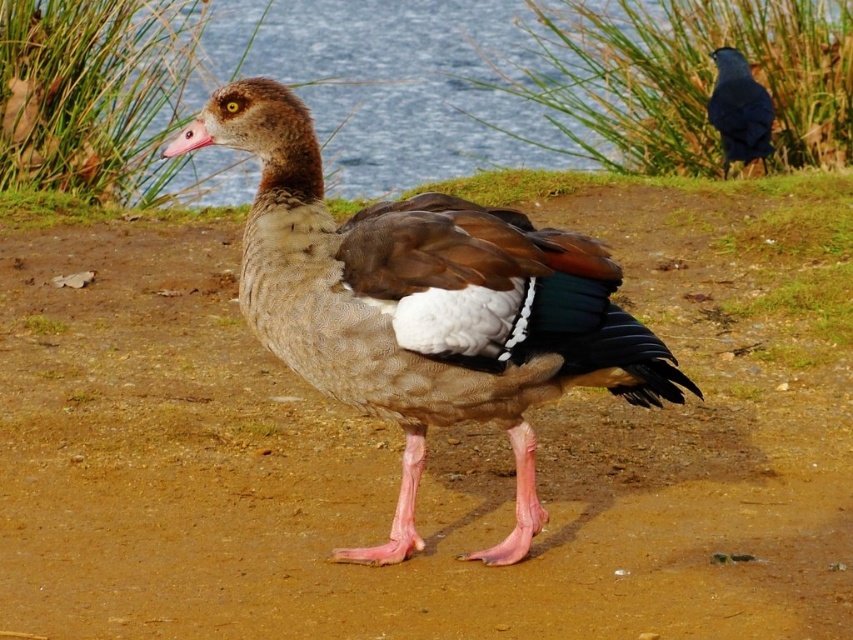
Question: Does brown dirt field at center have a greater width compared to shiny blue bird at upper right?

Choices:
 (A) no
 (B) yes

Answer: (B)

Question: Among these points, which one is farthest from the camera?

Choices:
 (A) (732, 145)
 (B) (520, 433)

Answer: (A)

Question: Does blue water at upper center have a smaller size compared to pink matte beak at center?

Choices:
 (A) yes
 (B) no

Answer: (B)

Question: Can you confirm if brown dirt field at center is bigger than brown feathered duck at center?

Choices:
 (A) yes
 (B) no

Answer: (A)

Question: Which object is farther from the camera taking this photo?

Choices:
 (A) blue water at upper center
 (B) brown feathered duck at center
 (C) brown dirt field at center

Answer: (A)

Question: Which of the following is the closest to the observer?

Choices:
 (A) (74, 173)
 (B) (515, 417)
 (C) (173, 156)

Answer: (C)